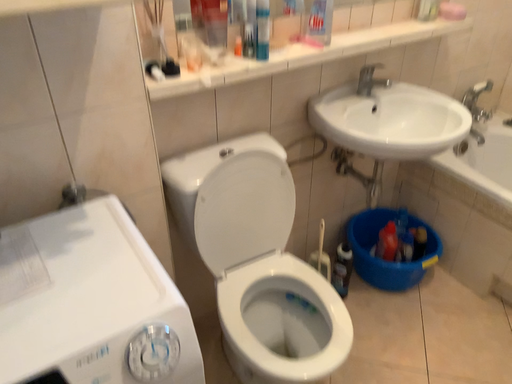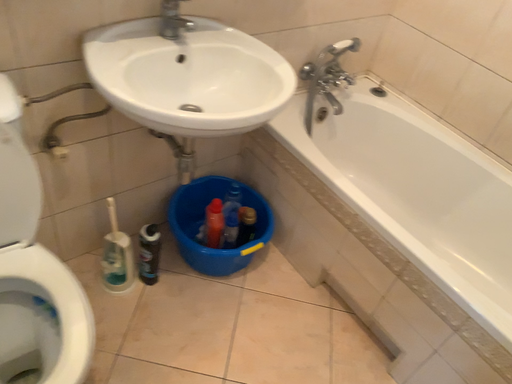
Question: How did the camera likely rotate when shooting the video?

Choices:
 (A) rotated upward
 (B) rotated downward

Answer: (B)